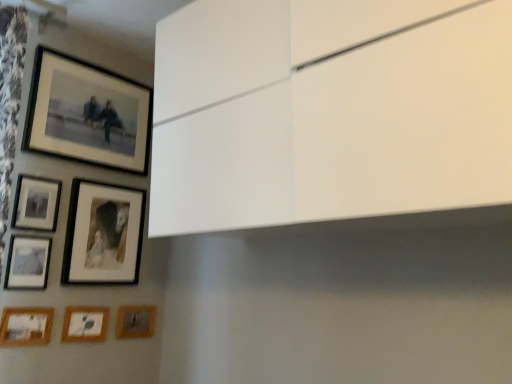
Locate an element on the screen. matte black picture frame at lower left, acting as the 4th picture frame starting from the bottom is located at coordinates (27, 263).

This screenshot has height=384, width=512. Describe the element at coordinates (36, 203) in the screenshot. I see `matte black picture frame at upper left, positioned as the second picture frame in top-to-bottom order` at that location.

You are a GUI agent. You are given a task and a screenshot of the screen. Output one action in this format:
    pyautogui.click(x=<x>, y=<y>)
    Task: Click on the matte black picture frame at upper left, the sixth picture frame ordered from the bottom
    This screenshot has width=512, height=384.
    Given the screenshot: What is the action you would take?
    pyautogui.click(x=36, y=203)

This screenshot has width=512, height=384. What do you see at coordinates (87, 113) in the screenshot?
I see `matte black picture frame at upper left, the seventh picture frame positioned from the bottom` at bounding box center [87, 113].

This screenshot has width=512, height=384. What do you see at coordinates (103, 234) in the screenshot?
I see `matte black picture frame at lower left, the third picture frame from the top` at bounding box center [103, 234].

Locate an element on the screen. The height and width of the screenshot is (384, 512). wooden textured picture frame at lower center, which is the 1th picture frame from bottom to top is located at coordinates (135, 321).

Considering the points (95, 326) and (41, 325), which point is in front, point (95, 326) or point (41, 325)?

Positioned in front is point (41, 325).

Locate an element on the screen. The height and width of the screenshot is (384, 512). picture frame that is the 5th object located in front of the wooden matte picture frame at lower left, which ranks as the sixth picture frame in top-to-bottom order is located at coordinates (26, 326).

Which of these two, wooden matte picture frame at lower left, which ranks as the sixth picture frame in top-to-bottom order, or wooden photo frame at lower left, acting as the third picture frame starting from the bottom, stands taller?

Standing taller between the two is wooden photo frame at lower left, acting as the third picture frame starting from the bottom.

Which object is positioned more to the left, wooden matte picture frame at lower left, which ranks as the sixth picture frame in top-to-bottom order, or wooden photo frame at lower left, acting as the third picture frame starting from the bottom?

From the viewer's perspective, wooden photo frame at lower left, acting as the third picture frame starting from the bottom, appears more on the left side.

Is matte black picture frame at upper left, positioned as the second picture frame in top-to-bottom order, at the back of matte black picture frame at lower left, acting as the 4th picture frame starting from the bottom?

No, matte black picture frame at upper left, positioned as the second picture frame in top-to-bottom order, is not at the back of matte black picture frame at lower left, acting as the 4th picture frame starting from the bottom.

Is matte black picture frame at lower left, acting as the 4th picture frame starting from the bottom, not close to matte black picture frame at upper left, positioned as the second picture frame in top-to-bottom order?

No, there isn't a large distance between matte black picture frame at lower left, acting as the 4th picture frame starting from the bottom, and matte black picture frame at upper left, positioned as the second picture frame in top-to-bottom order.

You are a GUI agent. You are given a task and a screenshot of the screen. Output one action in this format:
    pyautogui.click(x=<x>, y=<y>)
    Task: Click on the 1st picture frame in front of the matte black picture frame at upper left, the sixth picture frame ordered from the bottom
    
    Given the screenshot: What is the action you would take?
    pyautogui.click(x=27, y=263)

Considering the positions of points (36, 273) and (20, 196), is point (36, 273) farther from camera compared to point (20, 196)?

Yes, point (36, 273) is farther from viewer.

From the image's perspective, which one is positioned lower, matte black picture frame at lower left, acting as the 4th picture frame starting from the bottom, or matte black picture frame at lower left, the third picture frame from the top?

matte black picture frame at lower left, acting as the 4th picture frame starting from the bottom, appears lower in the image.

Which picture frame is the 5th one when counting from the left side of the matte black picture frame at lower left, the third picture frame from the top? Please provide its 2D coordinates.

[(27, 263)]

Can you tell me how much matte black picture frame at lower left, acting as the 4th picture frame starting from the bottom, and matte black picture frame at lower left, the third picture frame from the top, differ in facing direction?

There is a 0.298-degree angle between the facing directions of matte black picture frame at lower left, acting as the 4th picture frame starting from the bottom, and matte black picture frame at lower left, the third picture frame from the top.

How distant is matte black picture frame at lower left, the fourth picture frame from the top, from matte black picture frame at lower left, the third picture frame from the top?

matte black picture frame at lower left, the fourth picture frame from the top, is 8.81 inches from matte black picture frame at lower left, the third picture frame from the top.

Is point (39, 280) closer or farther from the camera than point (146, 322)?

Point (39, 280) is closer to the camera than point (146, 322).

Is matte black picture frame at lower left, the fourth picture frame from the top, in front of wooden textured picture frame at lower center, marked as the 7th picture frame in a top-to-bottom arrangement?

Yes, matte black picture frame at lower left, the fourth picture frame from the top, is in front of wooden textured picture frame at lower center, marked as the 7th picture frame in a top-to-bottom arrangement.

From a real-world perspective, between matte black picture frame at lower left, acting as the 4th picture frame starting from the bottom, and wooden textured picture frame at lower center, which is the 1th picture frame from bottom to top, who is vertically higher?

From a 3D spatial view, matte black picture frame at lower left, acting as the 4th picture frame starting from the bottom, is above.

Is matte black picture frame at upper left, the sixth picture frame ordered from the bottom, positioned beyond the bounds of wooden matte picture frame at lower left, which ranks as the sixth picture frame in top-to-bottom order?

Yes.

From their relative heights in the image, would you say matte black picture frame at upper left, the sixth picture frame ordered from the bottom, is taller or shorter than wooden matte picture frame at lower left, which ranks as the sixth picture frame in top-to-bottom order?

matte black picture frame at upper left, the sixth picture frame ordered from the bottom, is taller than wooden matte picture frame at lower left, which ranks as the sixth picture frame in top-to-bottom order.

From the image's perspective, is matte black picture frame at upper left, the sixth picture frame ordered from the bottom, above or below wooden matte picture frame at lower left, which ranks as the sixth picture frame in top-to-bottom order?

Based on their image positions, matte black picture frame at upper left, the sixth picture frame ordered from the bottom, is located above wooden matte picture frame at lower left, which ranks as the sixth picture frame in top-to-bottom order.

At what (x,y) coordinates should I click in order to perform the action: click on the 1st picture frame to the right when counting from the matte black picture frame at upper left, the seventh picture frame positioned from the bottom. Please return your answer as a coordinate pair (x, y). Looking at the image, I should click on (103, 234).

From a real-world perspective, which object rests below the other?

From a 3D spatial view, matte black picture frame at lower left, the third picture frame from the top, is below.

Based on their positions, is matte black picture frame at upper left, the seventh picture frame positioned from the bottom, located to the left or right of matte black picture frame at lower left, the fifth picture frame from the bottom?

Based on their positions, matte black picture frame at upper left, the seventh picture frame positioned from the bottom, is located to the left of matte black picture frame at lower left, the fifth picture frame from the bottom.

Which of these two, matte black picture frame at upper left, the seventh picture frame positioned from the bottom, or matte black picture frame at lower left, the third picture frame from the top, is smaller?

Smaller between the two is matte black picture frame at lower left, the third picture frame from the top.

Who is smaller, matte black picture frame at lower left, the fourth picture frame from the top, or matte black picture frame at upper left, the seventh picture frame positioned from the bottom?

matte black picture frame at lower left, the fourth picture frame from the top, is smaller.

Is matte black picture frame at lower left, the fourth picture frame from the top, facing towards matte black picture frame at upper left, marked as the first picture frame in a top-to-bottom arrangement?

No, matte black picture frame at lower left, the fourth picture frame from the top, is not aimed at matte black picture frame at upper left, marked as the first picture frame in a top-to-bottom arrangement.

Is matte black picture frame at lower left, the fourth picture frame from the top, positioned far away from matte black picture frame at upper left, marked as the first picture frame in a top-to-bottom arrangement?

Actually, matte black picture frame at lower left, the fourth picture frame from the top, and matte black picture frame at upper left, marked as the first picture frame in a top-to-bottom arrangement, are a little close together.

Is matte black picture frame at lower left, the fourth picture frame from the top, not within matte black picture frame at upper left, the seventh picture frame positioned from the bottom?

Yes, matte black picture frame at lower left, the fourth picture frame from the top, is outside of matte black picture frame at upper left, the seventh picture frame positioned from the bottom.

You are a GUI agent. You are given a task and a screenshot of the screen. Output one action in this format:
    pyautogui.click(x=<x>, y=<y>)
    Task: Click on the 2nd picture frame counting from the right of the wooden photo frame at lower left, which is counted as the fifth picture frame, starting from the top
    The height and width of the screenshot is (384, 512).
    Given the screenshot: What is the action you would take?
    pyautogui.click(x=84, y=324)

Starting from the matte black picture frame at lower left, the fourth picture frame from the top, which picture frame is the 1st one behind? Please provide its 2D coordinates.

[(36, 203)]

Estimate the real-world distances between objects in this image. Which object is further from matte black picture frame at lower left, acting as the 4th picture frame starting from the bottom, wooden textured picture frame at lower center, marked as the 7th picture frame in a top-to-bottom arrangement, or wooden matte picture frame at lower left, the second picture frame ordered from the bottom?

Among the two, wooden textured picture frame at lower center, marked as the 7th picture frame in a top-to-bottom arrangement, is located further to matte black picture frame at lower left, acting as the 4th picture frame starting from the bottom.

When comparing their distances from matte black picture frame at upper left, the seventh picture frame positioned from the bottom, does matte black picture frame at upper left, positioned as the second picture frame in top-to-bottom order, or wooden matte picture frame at lower left, which ranks as the sixth picture frame in top-to-bottom order, seem further?

Among the two, wooden matte picture frame at lower left, which ranks as the sixth picture frame in top-to-bottom order, is located further to matte black picture frame at upper left, the seventh picture frame positioned from the bottom.

From the picture: When comparing their distances from matte black picture frame at lower left, the fifth picture frame from the bottom, does matte black picture frame at upper left, the sixth picture frame ordered from the bottom, or matte black picture frame at lower left, acting as the 4th picture frame starting from the bottom, seem further?

matte black picture frame at lower left, acting as the 4th picture frame starting from the bottom, lies further to matte black picture frame at lower left, the fifth picture frame from the bottom, than the other object.

From the image, which object appears to be farther from wooden matte picture frame at lower left, which ranks as the sixth picture frame in top-to-bottom order, wooden textured picture frame at lower center, marked as the 7th picture frame in a top-to-bottom arrangement, or matte black picture frame at upper left, marked as the first picture frame in a top-to-bottom arrangement?

matte black picture frame at upper left, marked as the first picture frame in a top-to-bottom arrangement.

Based on their spatial positions, is wooden matte picture frame at lower left, which ranks as the sixth picture frame in top-to-bottom order, or matte black picture frame at lower left, the fifth picture frame from the bottom, closer to matte black picture frame at upper left, the seventh picture frame positioned from the bottom?

Among the two, matte black picture frame at lower left, the fifth picture frame from the bottom, is located nearer to matte black picture frame at upper left, the seventh picture frame positioned from the bottom.

Estimate the real-world distances between objects in this image. Which object is further from wooden matte picture frame at lower left, the second picture frame ordered from the bottom, matte black picture frame at upper left, the seventh picture frame positioned from the bottom, or matte black picture frame at lower left, the fifth picture frame from the bottom?

matte black picture frame at upper left, the seventh picture frame positioned from the bottom, is further to wooden matte picture frame at lower left, the second picture frame ordered from the bottom.

When comparing their distances from matte black picture frame at upper left, the sixth picture frame ordered from the bottom, does matte black picture frame at lower left, the fifth picture frame from the bottom, or wooden matte picture frame at lower left, which ranks as the sixth picture frame in top-to-bottom order, seem closer?

Among the two, matte black picture frame at lower left, the fifth picture frame from the bottom, is located nearer to matte black picture frame at upper left, the sixth picture frame ordered from the bottom.

Estimate the real-world distances between objects in this image. Which object is closer to wooden photo frame at lower left, which is counted as the fifth picture frame, starting from the top, matte black picture frame at upper left, positioned as the second picture frame in top-to-bottom order, or matte black picture frame at lower left, acting as the 4th picture frame starting from the bottom?

Based on the image, matte black picture frame at lower left, acting as the 4th picture frame starting from the bottom, appears to be nearer to wooden photo frame at lower left, which is counted as the fifth picture frame, starting from the top.

Image resolution: width=512 pixels, height=384 pixels. I want to click on picture frame between matte black picture frame at lower left, the fourth picture frame from the top, and wooden matte picture frame at lower left, which ranks as the sixth picture frame in top-to-bottom order, from top to bottom, so click(26, 326).

This screenshot has height=384, width=512. I want to click on picture frame between matte black picture frame at upper left, marked as the first picture frame in a top-to-bottom arrangement, and matte black picture frame at lower left, the fifth picture frame from the bottom, in the up-down direction, so click(36, 203).

Where is `picture frame between matte black picture frame at lower left, the fifth picture frame from the bottom, and wooden photo frame at lower left, which is counted as the fifth picture frame, starting from the top, in the up-down direction`? The image size is (512, 384). picture frame between matte black picture frame at lower left, the fifth picture frame from the bottom, and wooden photo frame at lower left, which is counted as the fifth picture frame, starting from the top, in the up-down direction is located at coordinates (27, 263).